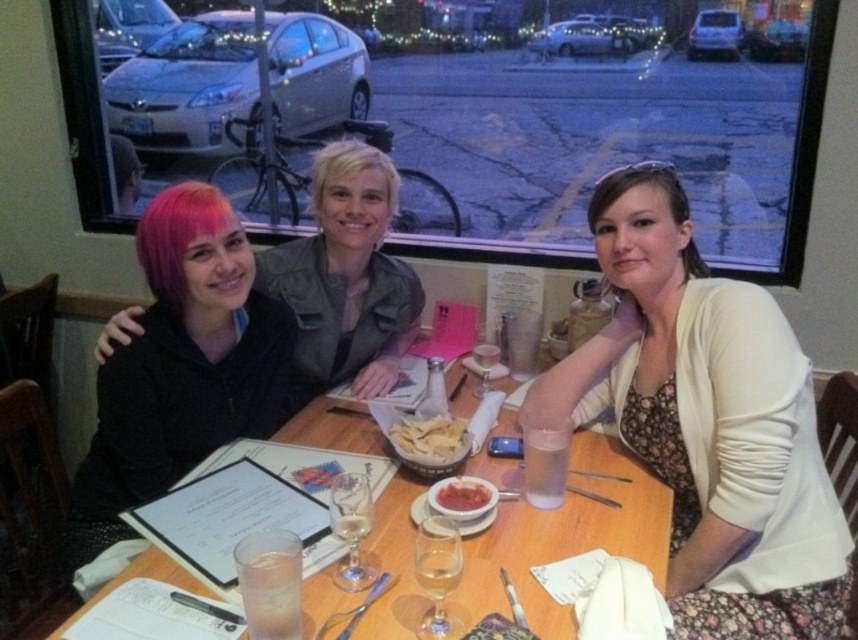
The image size is (858, 640). What do you see at coordinates (347, 275) in the screenshot? I see `pink hair at center` at bounding box center [347, 275].

Is pink hair at center below blondehair at center?

Indeed, pink hair at center is positioned under blondehair at center.

Who is more forward, (331, 304) or (331, 141)?

Point (331, 304)

At what (x,y) coordinates should I click in order to perform the action: click on pink hair at center. Please return your answer as a coordinate pair (x, y). The image size is (858, 640). Looking at the image, I should click on (347, 275).

From the picture: Can you confirm if floral dress at center is thinner than brown matte hair at upper right?

In fact, floral dress at center might be wider than brown matte hair at upper right.

Who is more distant from viewer, (625, 257) or (654, 168)?

The point (654, 168) is behind.

Is point (603, 260) positioned behind point (683, 252)?

No, (603, 260) is in front of (683, 252).

What are the coordinates of `floral dress at center` in the screenshot? It's located at (707, 422).

Is brown crispy chips at center further to the viewer compared to smooth matte red sauce at center?

Yes, it is behind smooth matte red sauce at center.

In the scene shown: Measure the distance between brown crispy chips at center and smooth matte red sauce at center.

5.29 inches

Which is behind, point (461, 428) or point (466, 481)?

Point (461, 428)

At what (x,y) coordinates should I click in order to perform the action: click on brown crispy chips at center. Please return your answer as a coordinate pair (x, y). This screenshot has width=858, height=640. Looking at the image, I should click on (429, 436).